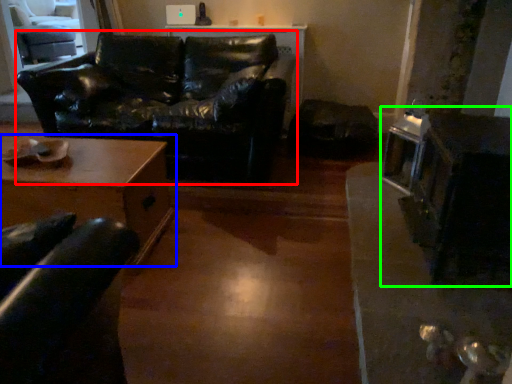
Question: Estimate the real-world distances between objects in this image. Which object is farther from studio couch (highlighted by a red box), table (highlighted by a blue box) or appliance (highlighted by a green box)?

Choices:
 (A) table
 (B) appliance

Answer: (B)